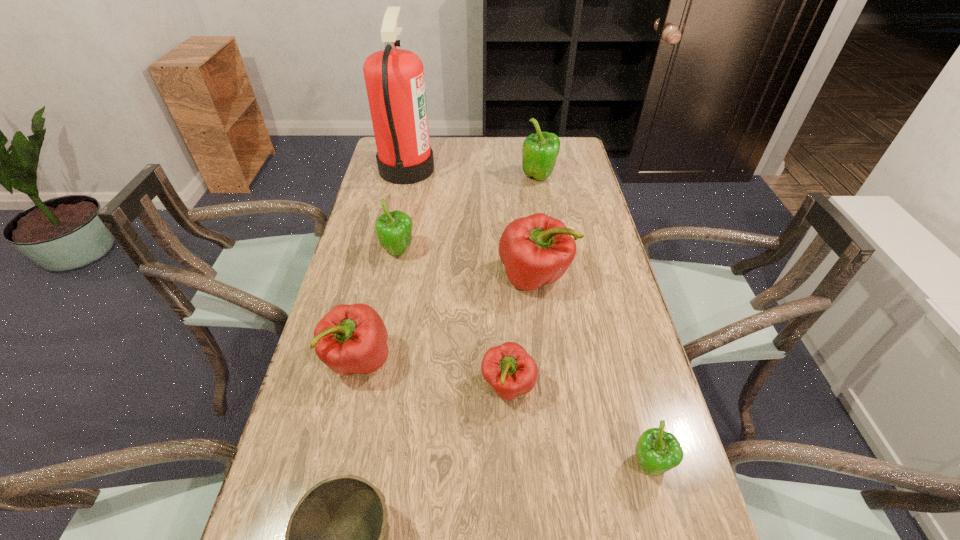
Locate an element on the screen. The image size is (960, 540). object positioned at the far left corner is located at coordinates (394, 78).

Find the location of a particular element. The height and width of the screenshot is (540, 960). free space at the far edge is located at coordinates (454, 161).

This screenshot has width=960, height=540. In order to click on vacant space at the left edge of the desktop in this screenshot , I will do `click(388, 210)`.

The height and width of the screenshot is (540, 960). In the image, there is a desktop. What are the coordinates of `free space at the right edge` in the screenshot? It's located at (619, 449).

Where is `vacant area between the smallest pink bell pepper and the second farthest green bell pepper`? The image size is (960, 540). vacant area between the smallest pink bell pepper and the second farthest green bell pepper is located at coordinates (453, 320).

Where is `free spot between the tallest object and the rightmost bell pepper`? free spot between the tallest object and the rightmost bell pepper is located at coordinates (528, 318).

Locate an element on the screen. This screenshot has width=960, height=540. vacant region between the rightmost green bell pepper and the fire extinguisher is located at coordinates (528, 318).

This screenshot has height=540, width=960. What are the coordinates of `free space between the second smallest pink bell pepper and the second green bell pepper from right to left` in the screenshot? It's located at (448, 269).

Image resolution: width=960 pixels, height=540 pixels. In order to click on unoccupied position between the biggest pink bell pepper and the red fire extinguisher in this screenshot , I will do `click(470, 223)`.

Where is `vacant space that's between the second smallest green bell pepper and the fire extinguisher`? The image size is (960, 540). vacant space that's between the second smallest green bell pepper and the fire extinguisher is located at coordinates (402, 211).